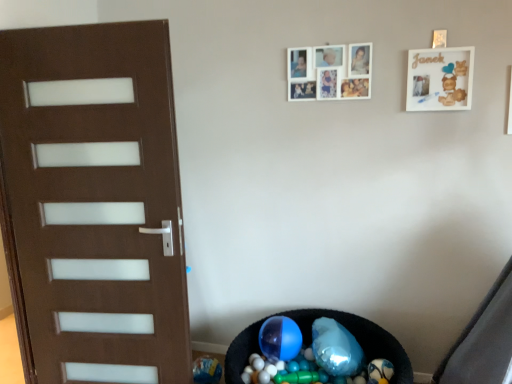
Question: Is translucent plastic balls at lower center wider or thinner than white matte picture frame at upper center, which is the first picture frame from left to right?

Choices:
 (A) wide
 (B) thin

Answer: (A)

Question: Is translucent plastic balls at lower center taller or shorter than white matte picture frame at upper center, which is the first picture frame from left to right?

Choices:
 (A) tall
 (B) short

Answer: (B)

Question: Which object is the farthest from the translucent plastic balls at lower center?

Choices:
 (A) white matte picture frame at upper center, acting as the second picture frame starting from the right
 (B) white matte picture frame at upper right, the first picture frame viewed from the right

Answer: (B)

Question: Estimate the real-world distances between objects in this image. Which object is farther from the white matte picture frame at upper center, which is the first picture frame from left to right?

Choices:
 (A) translucent plastic balls at lower center
 (B) white matte picture frame at upper right, the first picture frame viewed from the right

Answer: (A)